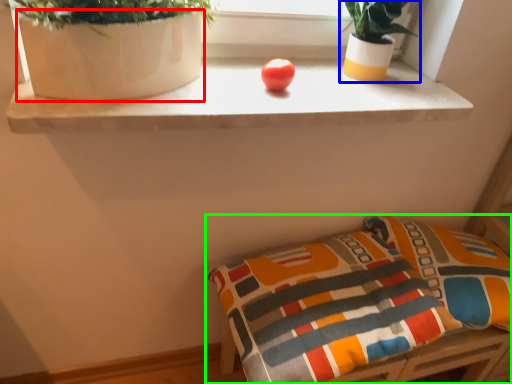
Question: Considering the real-world distances, which object is closest to vase (highlighted by a red box)? houseplant (highlighted by a blue box) or furniture (highlighted by a green box).

Choices:
 (A) houseplant
 (B) furniture

Answer: (A)